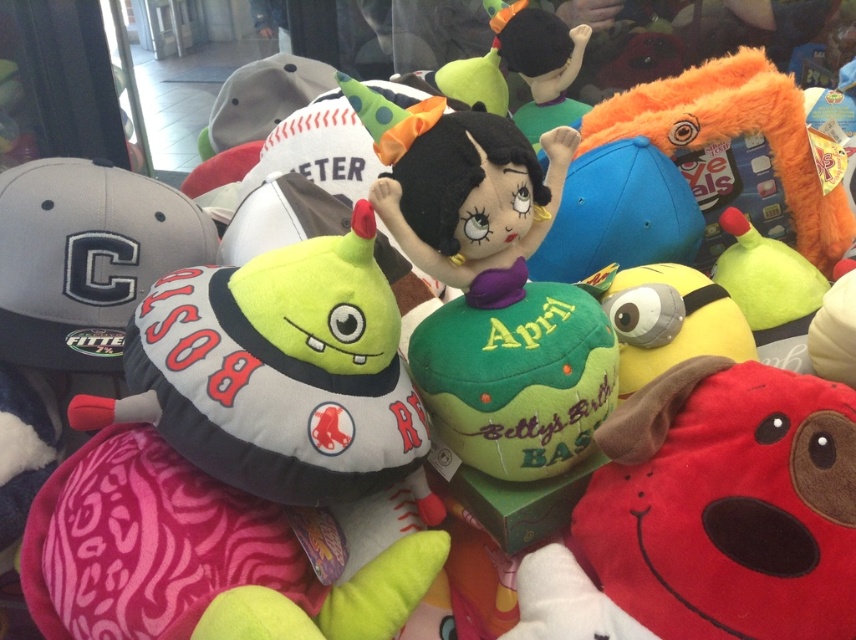
You are a customer in the store looking at the plush toys. You see the red dog with open mouth and expressive eyes, the green Boston Red Sox plush with a cap, and the velvet plush toy at center. Which plush toy is located exactly at the coordinates point (459,182)?

The velvet plush toy at center is located exactly at the coordinates point (459,182).

You are a customer in a store looking at the gray fabric baseball cap at left and the velvet plush toy at center. Which item is located to the right of the other?

The gray fabric baseball cap at left is positioned on the left side of velvet plush toy at center, so the velvet plush toy at center is to the right of the gray fabric baseball cap at left.

From the picture: You are a customer in a store looking at the gray fabric baseball cap at left and the gray fabric baseball cap at upper left. Which one is bigger?

The gray fabric baseball cap at left is larger in size than the gray fabric baseball cap at upper left.